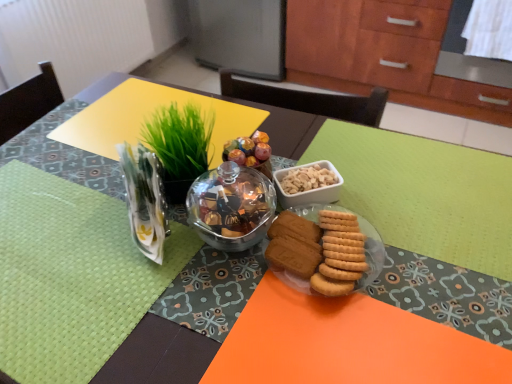
Question: Considering the relative sizes of clear plastic vase at upper left and matte glass bowl at center in the image provided, is clear plastic vase at upper left taller than matte glass bowl at center?

Choices:
 (A) no
 (B) yes

Answer: (A)

Question: Is clear plastic vase at upper left placed right next to matte glass bowl at center?

Choices:
 (A) yes
 (B) no

Answer: (B)

Question: Is clear plastic vase at upper left at the left side of matte glass bowl at center?

Choices:
 (A) yes
 (B) no

Answer: (A)

Question: From the image's perspective, is clear plastic vase at upper left beneath matte glass bowl at center?

Choices:
 (A) no
 (B) yes

Answer: (A)

Question: Does clear plastic vase at upper left have a lesser height compared to matte glass bowl at center?

Choices:
 (A) no
 (B) yes

Answer: (B)

Question: From a real-world perspective, relative to matte glass plate at center, is green leafy grass at upper center vertically above or below?

Choices:
 (A) below
 (B) above

Answer: (B)

Question: Do you think green leafy grass at upper center is within matte glass plate at center, or outside of it?

Choices:
 (A) outside
 (B) inside

Answer: (A)

Question: Is point (165, 165) positioned closer to the camera than point (333, 206)?

Choices:
 (A) farther
 (B) closer

Answer: (B)

Question: In the image, is green leafy grass at upper center on the left side or the right side of matte glass plate at center?

Choices:
 (A) right
 (B) left

Answer: (B)

Question: Looking at their shapes, would you say clear plastic vase at upper left is wider or thinner than green woven placemat at left?

Choices:
 (A) wide
 (B) thin

Answer: (B)

Question: From a real-world perspective, is clear plastic vase at upper left above or below green woven placemat at left?

Choices:
 (A) above
 (B) below

Answer: (A)

Question: Is point (130, 215) closer or farther from the camera than point (16, 253)?

Choices:
 (A) closer
 (B) farther

Answer: (B)

Question: Is clear plastic vase at upper left bigger or smaller than green woven placemat at left?

Choices:
 (A) small
 (B) big

Answer: (B)

Question: Is golden matte cookies at center inside or outside of clear plastic vase at upper left?

Choices:
 (A) inside
 (B) outside

Answer: (B)

Question: Considering the positions of golden matte cookies at center and clear plastic vase at upper left in the image, is golden matte cookies at center taller or shorter than clear plastic vase at upper left?

Choices:
 (A) short
 (B) tall

Answer: (A)